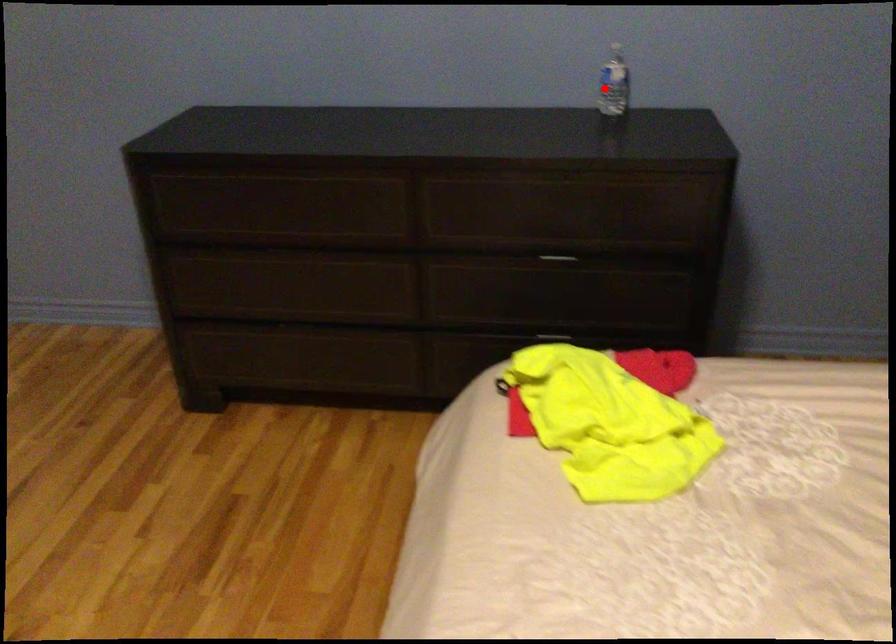
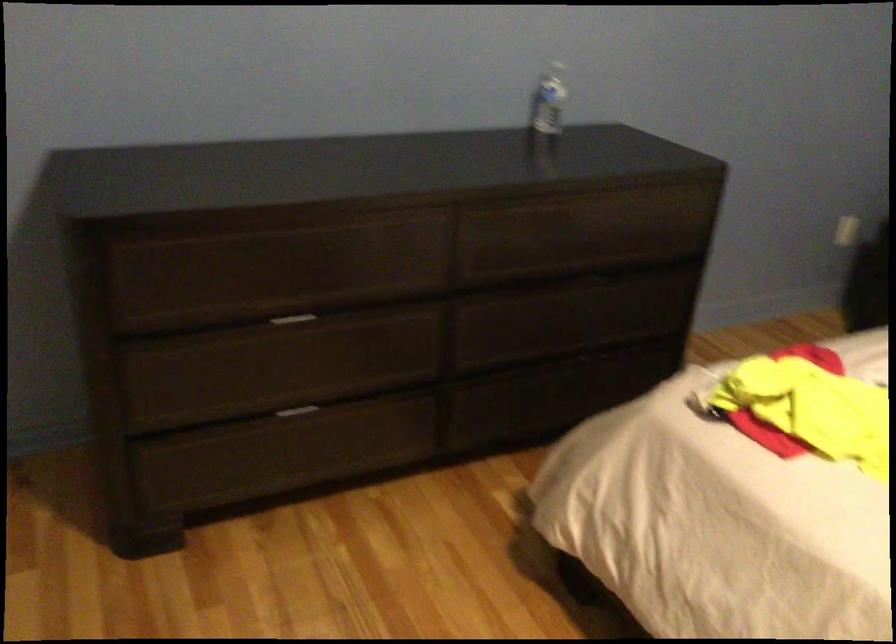
The point at the highlighted location is marked in the first image. Where is the corresponding point in the second image?

(548, 100)